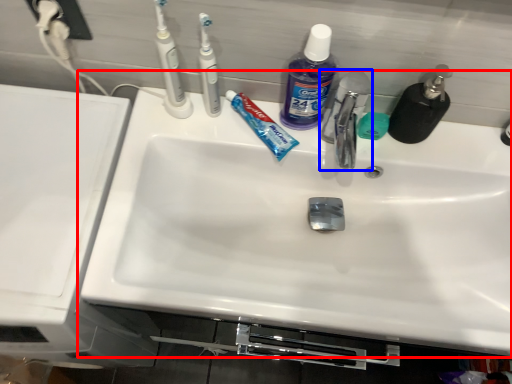
Question: Which point is closer to the camera, sink (highlighted by a red box) or tap (highlighted by a blue box)?

Choices:
 (A) sink
 (B) tap

Answer: (B)